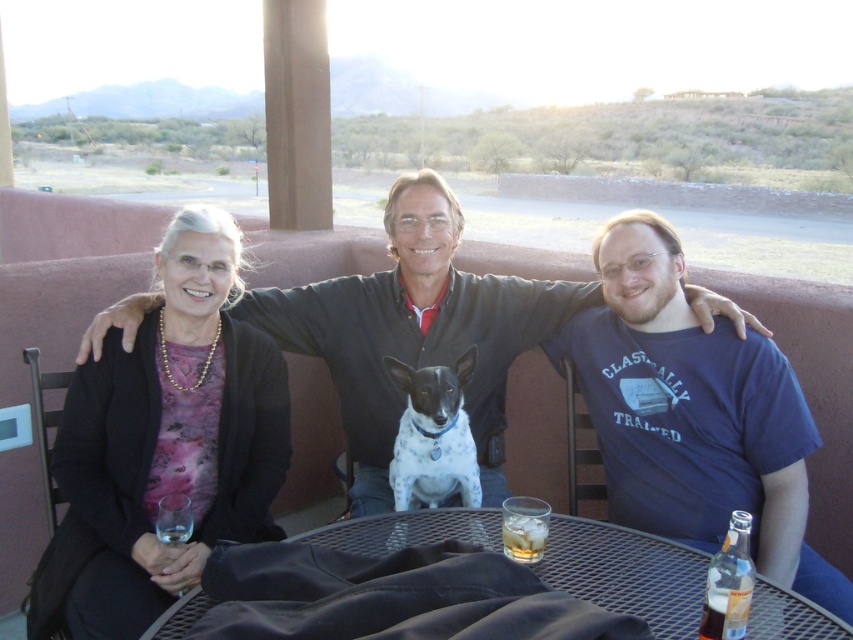
Question: Where is blue cotton shirt at center located in relation to clear glass bottle at lower right in the image?

Choices:
 (A) above
 (B) below

Answer: (A)

Question: Considering the real-world distances, which object is closest to the metallic mesh table at center?

Choices:
 (A) smooth brown shirt at center
 (B) clear glass bottle at lower right
 (C) blue cotton shirt at center

Answer: (B)

Question: Among these points, which one is nearest to the camera?

Choices:
 (A) (746, 557)
 (B) (509, 316)
 (C) (329, 532)

Answer: (A)

Question: Does clear glass bottle at lower right come in front of clear glass ice at table center?

Choices:
 (A) yes
 (B) no

Answer: (A)

Question: Does blue cotton shirt at center appear over brown glass bottle at lower right?

Choices:
 (A) no
 (B) yes

Answer: (B)

Question: Which point is farther to the camera?

Choices:
 (A) (689, 589)
 (B) (512, 540)

Answer: (B)